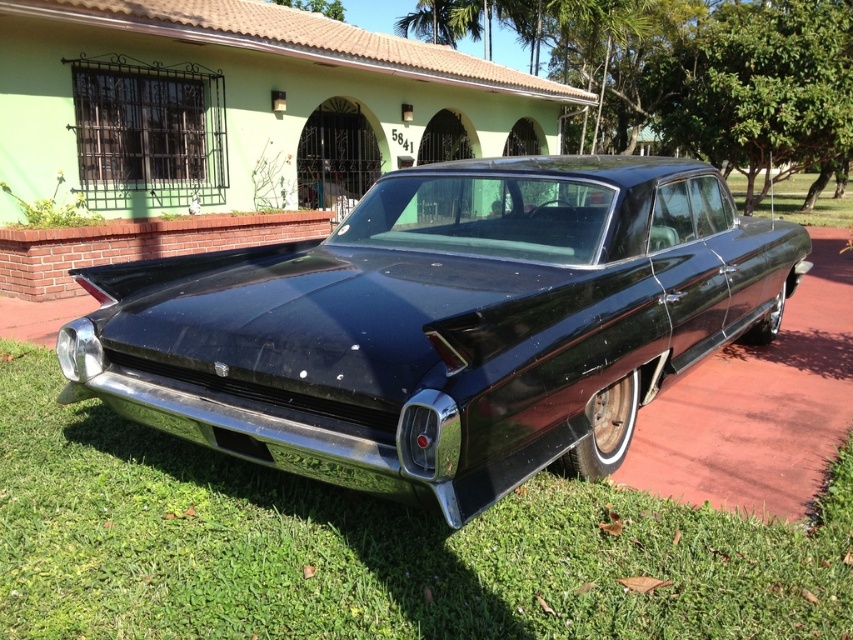
Question: Which point is closer to the camera?

Choices:
 (A) (7, 525)
 (B) (167, 342)

Answer: (A)

Question: Does glossy black car at center have a greater width compared to green grass at lower center?

Choices:
 (A) yes
 (B) no

Answer: (A)

Question: Can you confirm if glossy black car at center is wider than green grass at lower center?

Choices:
 (A) yes
 (B) no

Answer: (A)

Question: Can you confirm if glossy black car at center is positioned to the left of green grass at lower center?

Choices:
 (A) yes
 (B) no

Answer: (B)